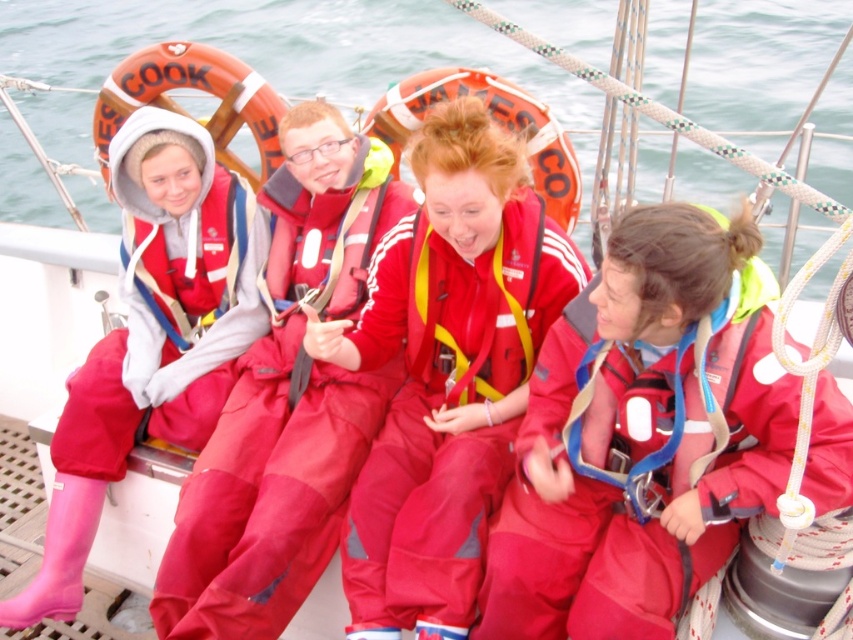
You are standing on the deck of the boat and want to place a new life jacket exactly where the shiny red life jacket at center is currently located. What are the coordinates you should use to position it?

The coordinates to position the new life jacket are at point (486, 301).

You are a sailor on the deck of a boat and need to step over an obstacle. You see the transparent water at center and the pink rubber boots at left. Which one is higher in elevation?

The transparent water at center is taller than the pink rubber boots at left, so the transparent water at center is higher in elevation.